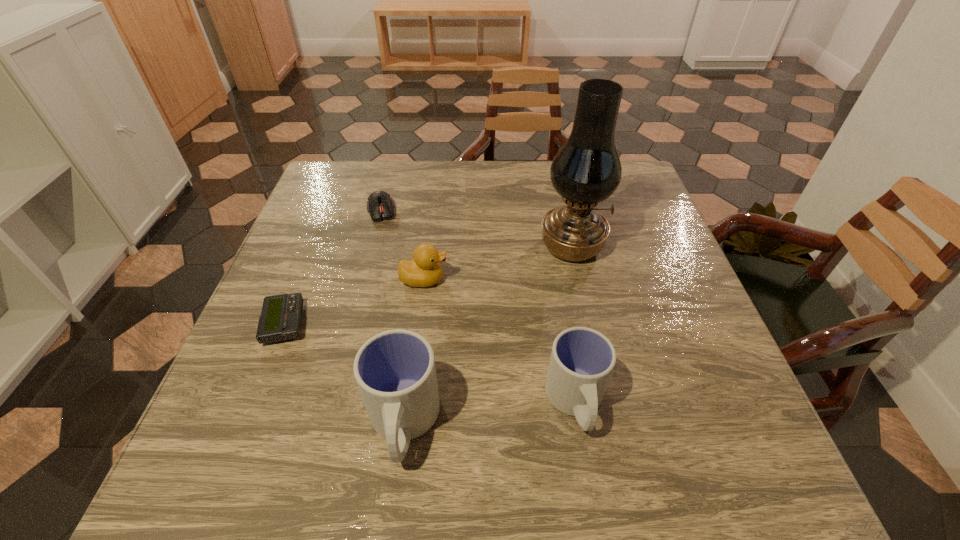
I want to click on vacant spot to place a cup on the right, so click(736, 383).